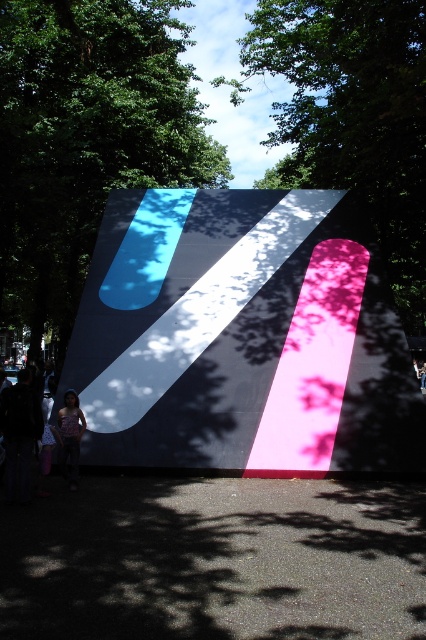
You are standing in a public space with an art installation. You notice two green leafy trees in the scene. Which tree is thinner between the green leafy tree at center and the green leafy tree at upper center?

The green leafy tree at center is thinner than the green leafy tree at upper center.

You are standing in front of the bold graphic installation and want to take a photo of the green leafy tree at upper center. Where should you position your camera to capture the tree in the frame?

Position your camera at the point corresponding to the coordinates of the green leafy tree at upper center, which is at point (x=354, y=116), to ensure it is centered in the frame.

Based on the photo, you are a photographer trying to capture the entire installation without any obstructions. You notice the green leafy tree at center and the matte pink dress at lower left in your frame. Which object might block your view of the installation, and why?

The green leafy tree at center is much taller than the matte pink dress at lower left, so it is more likely to block your view of the installation.